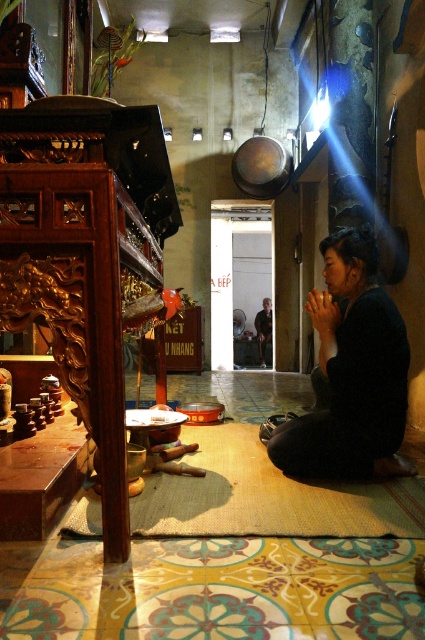
Question: Is black matte dress at lower right above dark brown leather jacket at center?

Choices:
 (A) yes
 (B) no

Answer: (A)

Question: Does black matte dress at lower right lie in front of dark brown leather jacket at center?

Choices:
 (A) no
 (B) yes

Answer: (B)

Question: Which of the following is the closest to the observer?

Choices:
 (A) black matte dress at lower right
 (B) dark brown leather jacket at center

Answer: (A)

Question: Does black matte dress at lower right come behind dark brown leather jacket at center?

Choices:
 (A) yes
 (B) no

Answer: (B)